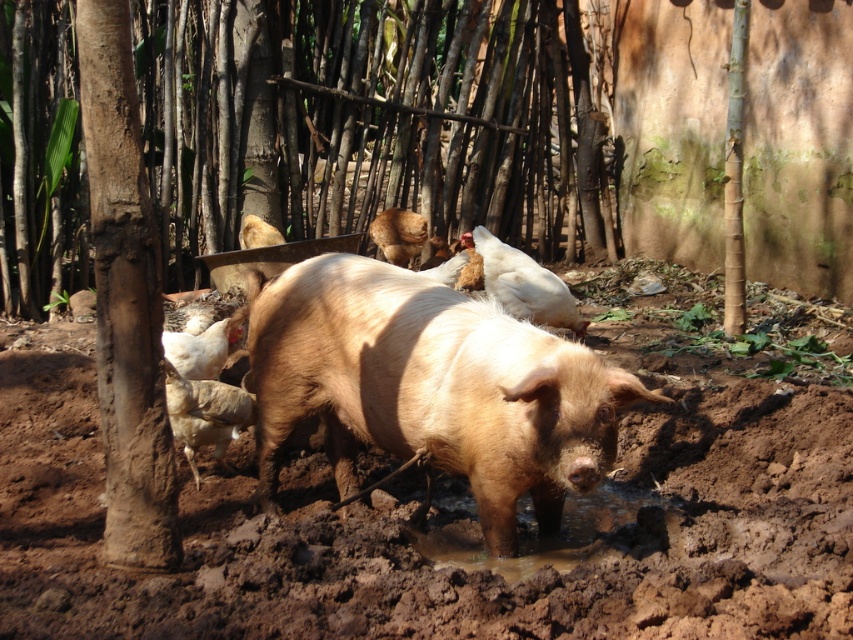
You are a chicken in the scene and want to move from the brown wet mud at center to the muddy wet puddle at lower center. Which direction should you go to get there?

The brown wet mud at center is closer to the viewer than the muddy wet puddle at lower center, so you should move away from the viewer to reach the muddy wet puddle at lower center.

You are a farmer who needs to separate the light brown glossy pig at center and the light brown fur at center by at least 3 meters to prevent them from interacting. Based on the scene, can you confirm if they are already separated by the required distance?

The distance between the light brown glossy pig at center and the light brown fur at center is 3.40 meters, which is more than the required 3 meters. Therefore, they are already separated by the necessary distance.